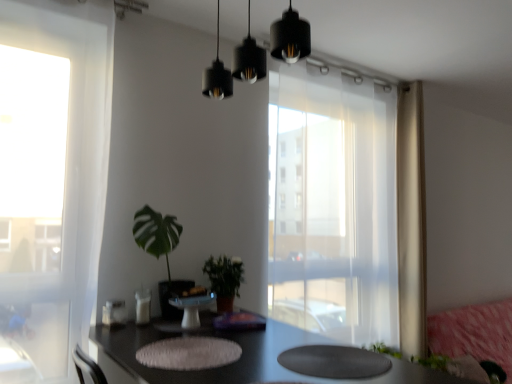
Question: Is pink fabric couch at lower right in front of or behind green leafy plant at center, positioned as the 1th houseplant in left-to-right order, in the image?

Choices:
 (A) front
 (B) behind

Answer: (B)

Question: Is pink fabric couch at lower right bigger or smaller than green leafy plant at center, positioned as the 1th houseplant in left-to-right order?

Choices:
 (A) big
 (B) small

Answer: (A)

Question: Which object is the farthest from the white glossy cake stand at center?

Choices:
 (A) green matte plant at center, the first houseplant viewed from the right
 (B) black matte pendant lights at upper center
 (C) green leafy plant at center, positioned as the second houseplant in right-to-left order
 (D) transparent curtain at center
 (E) pink fabric couch at lower right

Answer: (E)

Question: Considering the real-world distances, which object is farthest from the green leafy plant at center, positioned as the 1th houseplant in left-to-right order?

Choices:
 (A) black glossy table at center
 (B) green matte plant at center, the first houseplant viewed from the right
 (C) transparent curtain at center
 (D) white glossy cake stand at center
 (E) black matte pendant lights at upper center

Answer: (C)